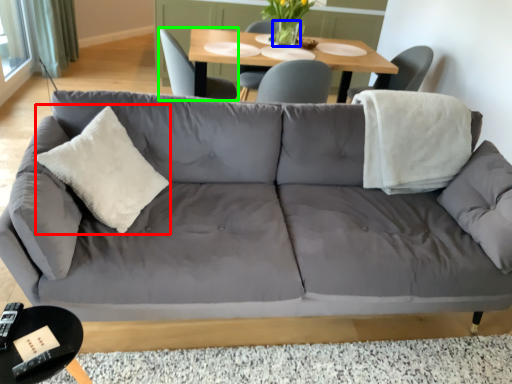
Question: Which object is the farthest from throw pillow (highlighted by a red box)? Choose among these: vase (highlighted by a blue box) or chair (highlighted by a green box).

Choices:
 (A) vase
 (B) chair

Answer: (A)